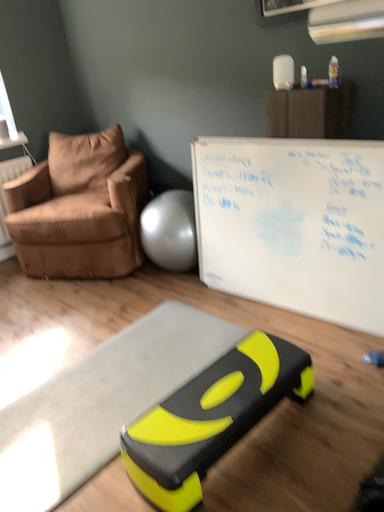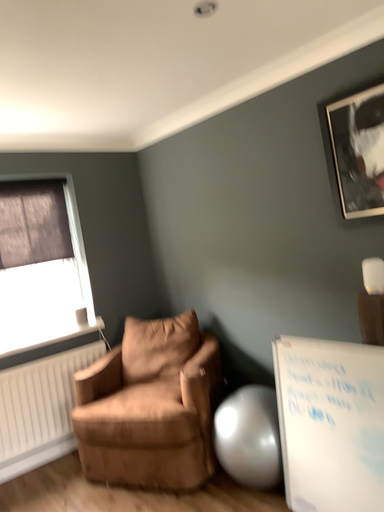
Question: How did the camera likely rotate when shooting the video?

Choices:
 (A) rotated downward
 (B) rotated upward

Answer: (B)